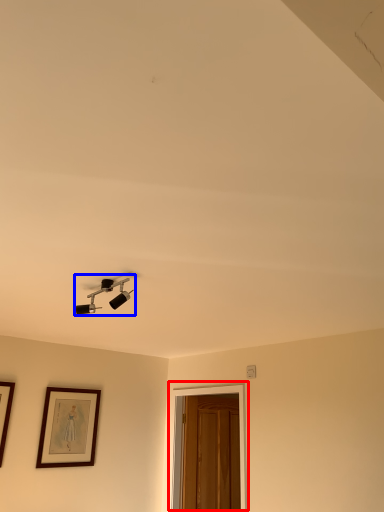
Question: Among these objects, which one is farthest to the camera, glass door (highlighted by a red box) or lamp (highlighted by a blue box)?

Choices:
 (A) glass door
 (B) lamp

Answer: (A)